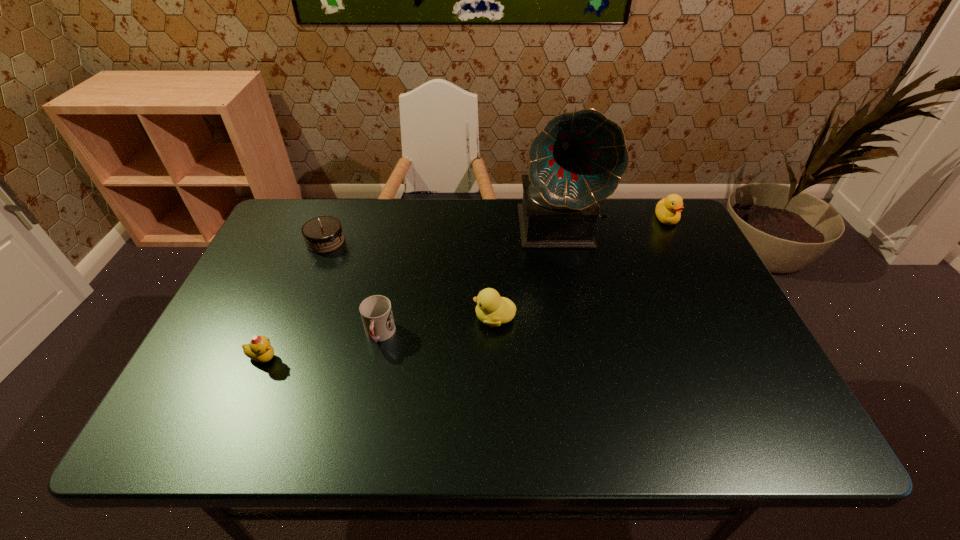
At what (x,y) coordinates should I click in order to perform the action: click on object identified as the fourth closest to the chocolate cake. Please return your answer as a coordinate pair (x, y). This screenshot has width=960, height=540. Looking at the image, I should click on pos(578,159).

Identify which object is the closest to the leftmost duckling. Please provide its 2D coordinates. Your answer should be formatted as a tuple, i.e. [(x, y)], where the tuple contains the x and y coordinates of a point satisfying the conditions above.

[(376, 312)]

Image resolution: width=960 pixels, height=540 pixels. I want to click on duckling that is the third closest to the chocolate cake, so click(668, 210).

Where is `the third closest duckling to the record player`? Image resolution: width=960 pixels, height=540 pixels. the third closest duckling to the record player is located at coordinates (259, 349).